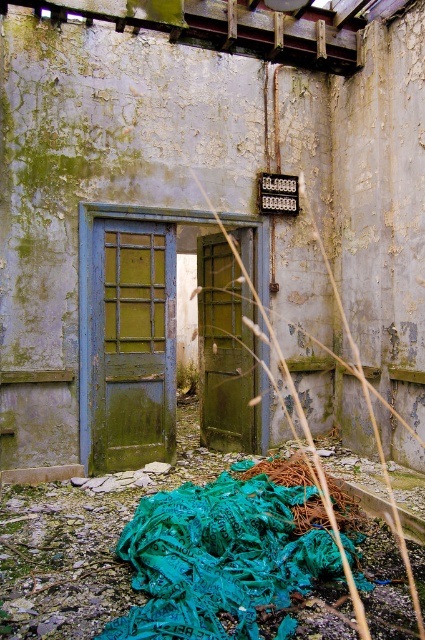
Describe the element at coordinates (133, 342) in the screenshot. The height and width of the screenshot is (640, 425). I see `green matte door at left` at that location.

Who is shorter, green matte door at left or green matte door at center?

Standing shorter between the two is green matte door at left.

Which is behind, point (142, 326) or point (238, 320)?

The point (238, 320) is more distant.

In order to click on green matte door at left in this screenshot , I will do `click(133, 342)`.